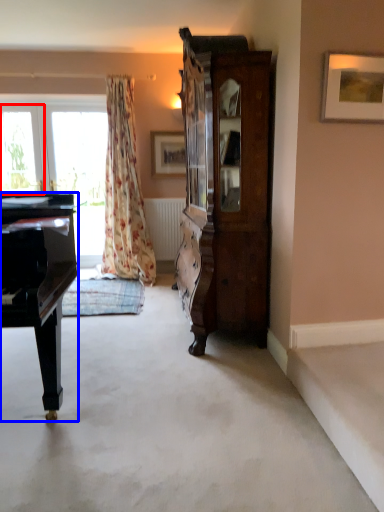
Question: Which of the following is the closest to the observer, window (highlighted by a red box) or piano (highlighted by a blue box)?

Choices:
 (A) window
 (B) piano

Answer: (B)